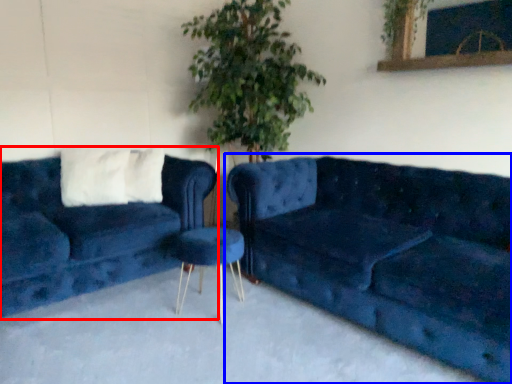
Question: Which object appears closest to the camera in this image, studio couch (highlighted by a red box) or studio couch (highlighted by a blue box)?

Choices:
 (A) studio couch
 (B) studio couch

Answer: (B)